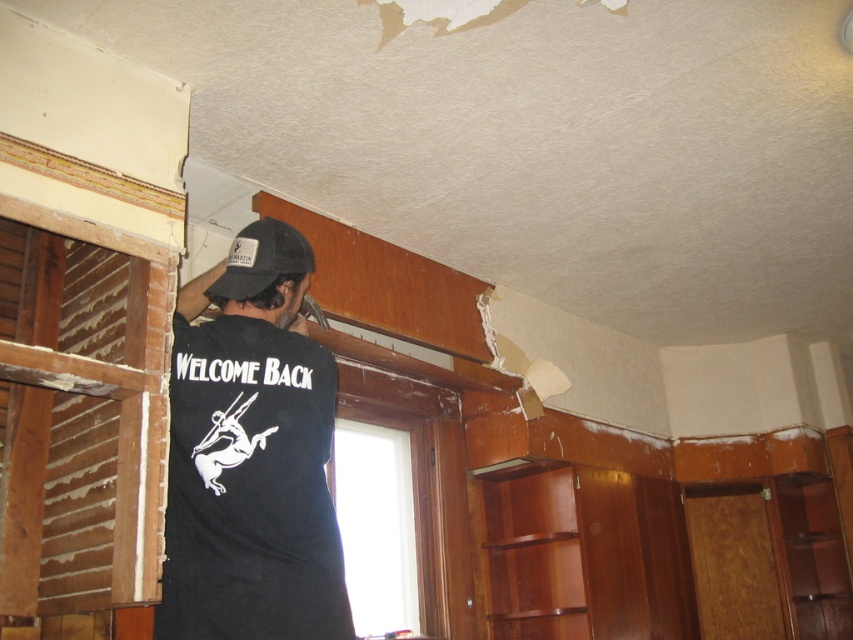
Question: Does black matte t-shirt at center have a larger size compared to black fabric baseball cap at upper center?

Choices:
 (A) yes
 (B) no

Answer: (A)

Question: Which object is closer to the camera taking this photo?

Choices:
 (A) black matte t-shirt at center
 (B) black fabric baseball cap at upper center

Answer: (A)

Question: Does black matte t-shirt at center appear over black fabric baseball cap at upper center?

Choices:
 (A) no
 (B) yes

Answer: (A)

Question: Is black matte t-shirt at center to the left of black fabric baseball cap at upper center from the viewer's perspective?

Choices:
 (A) no
 (B) yes

Answer: (B)

Question: Which of the following is the farthest from the observer?

Choices:
 (A) tap(306, 378)
 (B) tap(235, 243)

Answer: (B)